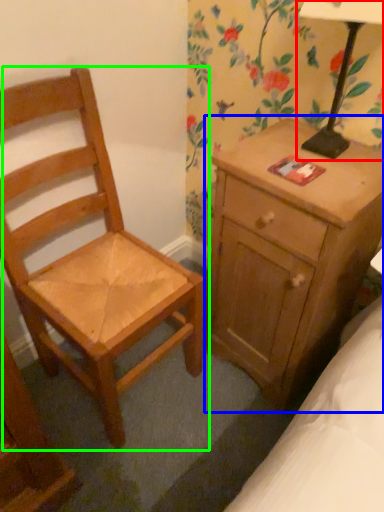
Question: Which is nearer to the table lamp (highlighted by a red box)? nightstand (highlighted by a blue box) or chair (highlighted by a green box).

Choices:
 (A) nightstand
 (B) chair

Answer: (A)